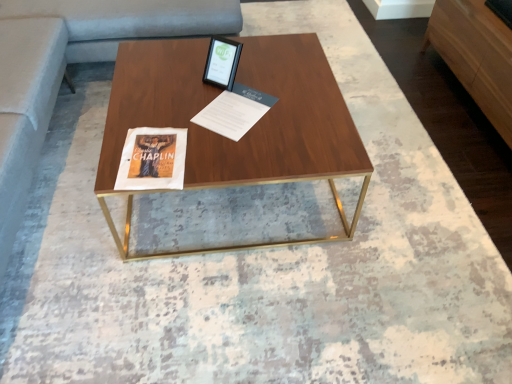
Identify the location of free space above walnut wood coffee table at center (from a real-world perspective). (189, 96).